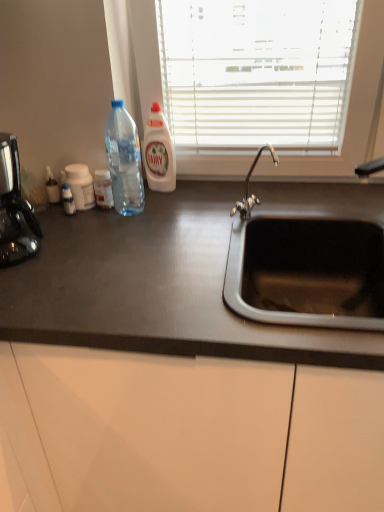
Where is `free spot in front of transparent plastic bottle at left, the 3th bottle viewed from the left`? This screenshot has height=512, width=384. free spot in front of transparent plastic bottle at left, the 3th bottle viewed from the left is located at coordinates (122, 234).